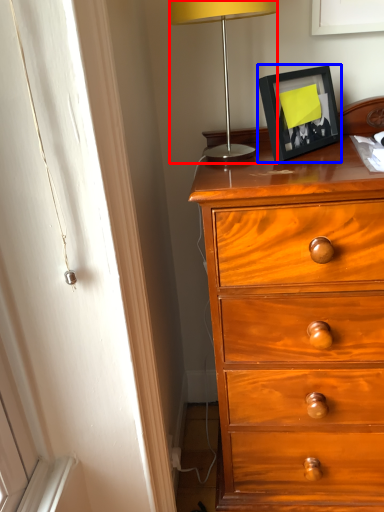
Question: Which object is further to the camera taking this photo, lamp (highlighted by a red box) or picture frame (highlighted by a blue box)?

Choices:
 (A) lamp
 (B) picture frame

Answer: (B)